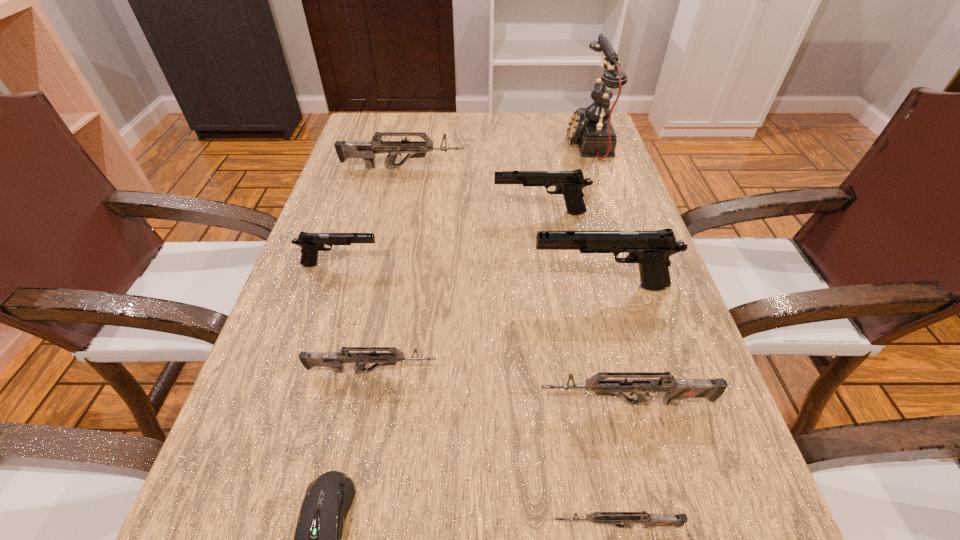
The width and height of the screenshot is (960, 540). I want to click on free space located 0.150m aimed along the barrel of the seventh tallest object, so click(x=529, y=372).

The height and width of the screenshot is (540, 960). What are the coordinates of `free space located 0.050m aimed along the barrel of the nearest gun` in the screenshot? It's located at (514, 526).

I want to click on vacant space located 0.220m aimed along the barrel of the nearest gun, so click(x=382, y=526).

Where is `free space located 0.110m aimed along the barrel of the nearest gun`? free space located 0.110m aimed along the barrel of the nearest gun is located at coordinates (468, 526).

What are the coordinates of `object that is at the far edge` in the screenshot? It's located at (591, 127).

Where is `telephone present at the right edge`? The width and height of the screenshot is (960, 540). telephone present at the right edge is located at coordinates (591, 127).

You are a GUI agent. You are given a task and a screenshot of the screen. Output one action in this format:
    pyautogui.click(x=<x>, y=<y>)
    Task: Click on the object that is at the far right corner
    
    Given the screenshot: What is the action you would take?
    pyautogui.click(x=591, y=127)

Identify the location of vacant space at the far edge. This screenshot has width=960, height=540. (534, 146).

Locate an element on the screen. This screenshot has width=960, height=540. vacant space at the left edge is located at coordinates pyautogui.click(x=373, y=171).

The image size is (960, 540). What are the coordinates of `vacant position at the right edge of the desktop` in the screenshot? It's located at (585, 221).